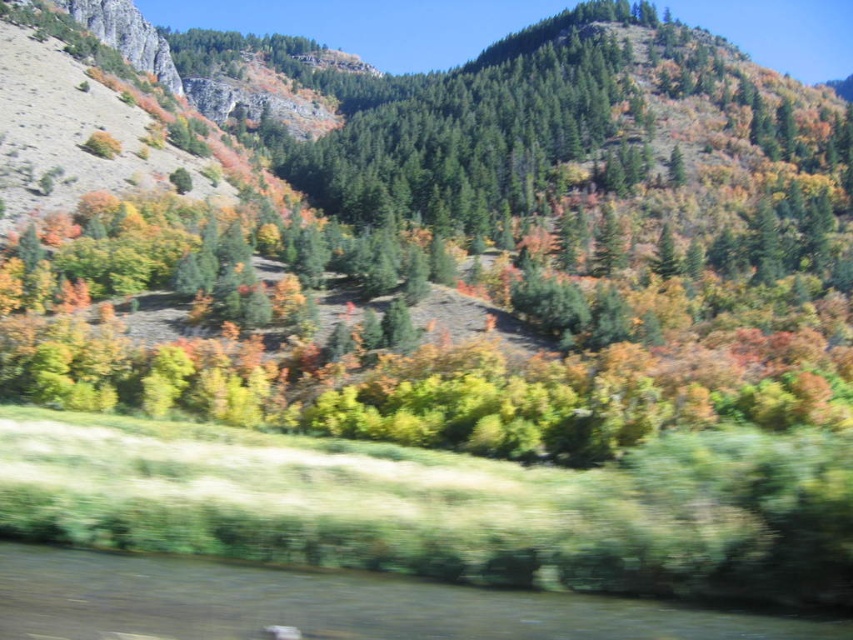
Can you confirm if green matte tree at center is bigger than green grassy river at lower center?

Correct, green matte tree at center is larger in size than green grassy river at lower center.

How far apart are green matte tree at center and green grassy river at lower center?

A distance of 214.93 meters exists between green matte tree at center and green grassy river at lower center.

You are a GUI agent. You are given a task and a screenshot of the screen. Output one action in this format:
    pyautogui.click(x=<x>, y=<y>)
    Task: Click on the green matte tree at center
    
    Given the screenshot: What is the action you would take?
    pyautogui.click(x=480, y=248)

Where is `green matte tree at center`? green matte tree at center is located at coordinates [x=480, y=248].